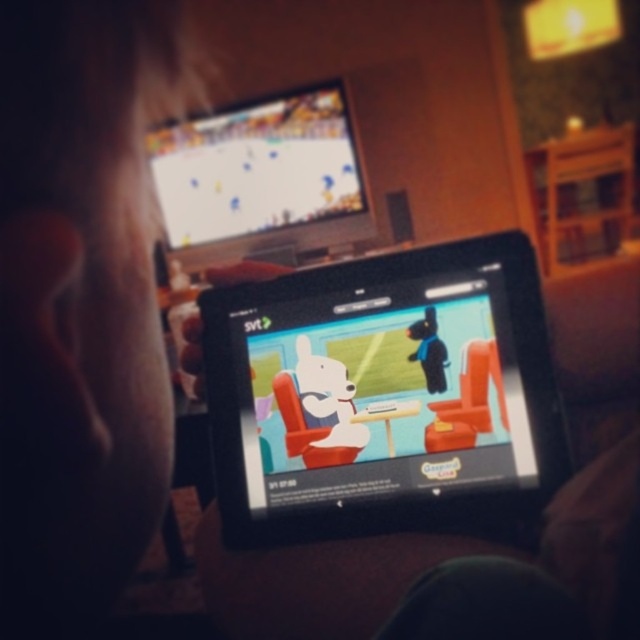
Question: Can you confirm if black glossy tablet at center is wider than matte plastic tv at upper center?

Choices:
 (A) yes
 (B) no

Answer: (B)

Question: Can you confirm if black glossy tablet at center is smaller than matte plastic tv at upper center?

Choices:
 (A) no
 (B) yes

Answer: (B)

Question: Is black glossy tablet at center to the left of matte plastic tv at upper center from the viewer's perspective?

Choices:
 (A) no
 (B) yes

Answer: (A)

Question: Which of the following is the farthest from the observer?

Choices:
 (A) matte plastic tv at upper center
 (B) black glossy tablet at center

Answer: (A)